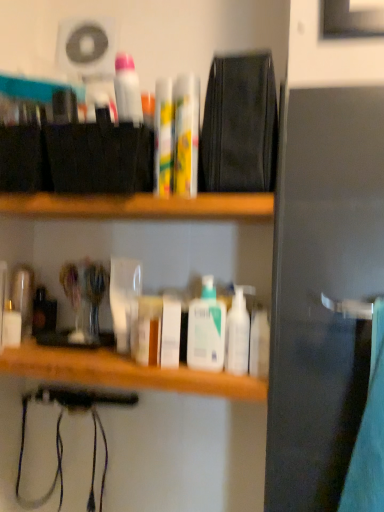
What are the coordinates of `yellow matte tube at center, the 4th toiletry positioned from the right` in the screenshot? It's located at (186, 134).

The height and width of the screenshot is (512, 384). What do you see at coordinates (147, 331) in the screenshot? I see `translucent plastic jar at center, placed as the 7th toiletry when sorted from right to left` at bounding box center [147, 331].

Locate an element on the screen. This screenshot has width=384, height=512. clear glass jar at center, positioned as the eighth toiletry in right-to-left order is located at coordinates (123, 297).

Which object is positioned more to the right, white glossy lotion at center, acting as the 8th toiletry starting from the left, or white glossy toothpaste at upper center?

From the viewer's perspective, white glossy lotion at center, acting as the 8th toiletry starting from the left, appears more on the right side.

From the image's perspective, which is above, white glossy lotion at center, the 3th toiletry positioned from the right, or white glossy toothpaste at upper center?

white glossy toothpaste at upper center appears higher in the image.

Is white glossy toothpaste at upper center a part of white glossy lotion at center, acting as the 8th toiletry starting from the left?

That's incorrect, white glossy toothpaste at upper center is not inside white glossy lotion at center, acting as the 8th toiletry starting from the left.

How different are the orientations of white glossy lotion at center, acting as the 8th toiletry starting from the left, and white glossy toothpaste at upper center in degrees?

They differ by 0.00533 degrees in their facing directions.

Is white glossy bottles at center to the left or to the right of white glossy lotion at center, the second toiletry positioned from the right, in the image?

white glossy bottles at center is to the left of white glossy lotion at center, the second toiletry positioned from the right.

Does white glossy bottles at center come behind white glossy lotion at center, the second toiletry positioned from the right?

That is False.

This screenshot has width=384, height=512. I want to click on the 7th toiletry to the right of the white glossy bottles at center, counting from the anchor's position, so click(238, 332).

From the picture: From the image's perspective, does white glossy bottles at center appear higher than white glossy lotion at center, the ninth toiletry from the left?

Incorrect, from the image's perspective, white glossy bottles at center is lower than white glossy lotion at center, the ninth toiletry from the left.

Is clear glass jar at left, which appears as the 9th toiletry when viewed from the right, bigger or smaller than white glossy lotion at center, acting as the 8th toiletry starting from the left?

clear glass jar at left, which appears as the 9th toiletry when viewed from the right, is bigger than white glossy lotion at center, acting as the 8th toiletry starting from the left.

From a real-world perspective, is clear glass jar at left, placed as the 2th toiletry when sorted from left to right, located higher than white glossy lotion at center, acting as the 8th toiletry starting from the left?

Yes.

Is clear glass jar at left, placed as the 2th toiletry when sorted from left to right, positioned in front of white glossy lotion at center, the 3th toiletry positioned from the right?

That is False.

Starting from the clear glass jar at left, placed as the 2th toiletry when sorted from left to right, which toiletry is the 5th one in front? Please provide its 2D coordinates.

[(206, 329)]

From a real-world perspective, is clear glass jar at left, placed as the 2th toiletry when sorted from left to right, positioned above or below white glossy lotion at center, which appears as the 10th toiletry when viewed from the left?

clear glass jar at left, placed as the 2th toiletry when sorted from left to right, is situated higher than white glossy lotion at center, which appears as the 10th toiletry when viewed from the left, in the real world.

Identify the location of the 7th toiletry behind the white glossy lotion at center, which appears as the 10th toiletry when viewed from the left, starting your count from the anchor. (23, 298).

Visually, is clear glass jar at left, which appears as the 9th toiletry when viewed from the right, positioned to the left or to the right of white glossy lotion at center, marked as the 1th toiletry in a right-to-left arrangement?

clear glass jar at left, which appears as the 9th toiletry when viewed from the right, is positioned on white glossy lotion at center, marked as the 1th toiletry in a right-to-left arrangement,'s left side.

From the image's perspective, is clear glass jar at left, placed as the 2th toiletry when sorted from left to right, located beneath white glossy lotion at center, which appears as the 10th toiletry when viewed from the left?

Incorrect, from the image's perspective, clear glass jar at left, placed as the 2th toiletry when sorted from left to right, is higher than white glossy lotion at center, which appears as the 10th toiletry when viewed from the left.

Is white glossy toothpaste at upper center taller than translucent plastic jar at center, placed as the 7th toiletry when sorted from right to left?

In fact, white glossy toothpaste at upper center may be shorter than translucent plastic jar at center, placed as the 7th toiletry when sorted from right to left.

Is white glossy toothpaste at upper center closer to camera compared to translucent plastic jar at center, placed as the 7th toiletry when sorted from right to left?

Yes, white glossy toothpaste at upper center is closer to the viewer.

Which is correct: white glossy toothpaste at upper center is inside translucent plastic jar at center, arranged as the fourth toiletry when viewed from the left, or outside of it?

white glossy toothpaste at upper center exists outside the volume of translucent plastic jar at center, arranged as the fourth toiletry when viewed from the left.

Is white glossy toothpaste at upper center touching translucent plastic jar at center, placed as the 7th toiletry when sorted from right to left?

white glossy toothpaste at upper center and translucent plastic jar at center, placed as the 7th toiletry when sorted from right to left, are clearly separated.

Consider the image. Could you tell me if white glossy lotion at center, acting as the fifth toiletry starting from the right, is turned towards white glossy lotion at center, the ninth toiletry from the left?

No, white glossy lotion at center, acting as the fifth toiletry starting from the right, is not facing towards white glossy lotion at center, the ninth toiletry from the left.

From their relative heights in the image, would you say white glossy lotion at center, the 6th toiletry in the left-to-right sequence, is taller or shorter than white glossy lotion at center, the ninth toiletry from the left?

white glossy lotion at center, the 6th toiletry in the left-to-right sequence, is shorter than white glossy lotion at center, the ninth toiletry from the left.

Which is in front, white glossy lotion at center, the 6th toiletry in the left-to-right sequence, or white glossy lotion at center, the ninth toiletry from the left?

white glossy lotion at center, the ninth toiletry from the left, is in front.

Considering the relative sizes of white glossy lotion at center, acting as the fifth toiletry starting from the right, and white glossy lotion at center, the ninth toiletry from the left, in the image provided, is white glossy lotion at center, acting as the fifth toiletry starting from the right, thinner than white glossy lotion at center, the ninth toiletry from the left,?

No.

Is yellow-green plastic tubes at center, the 5th toiletry positioned from the left, thinner than white glossy toothpaste at upper center?

Yes.

From the image's perspective, who appears lower, yellow-green plastic tubes at center, the 5th toiletry positioned from the left, or white glossy toothpaste at upper center?

yellow-green plastic tubes at center, the 5th toiletry positioned from the left, is shown below in the image.

Which toiletry is the 2nd one when counting from the right side of the white glossy toothpaste at upper center? Please provide its 2D coordinates.

[(163, 138)]

What's the angular difference between yellow-green plastic tubes at center, the 5th toiletry positioned from the left, and white glossy toothpaste at upper center's facing directions?

0.00107 degrees separate the facing orientations of yellow-green plastic tubes at center, the 5th toiletry positioned from the left, and white glossy toothpaste at upper center.

Find the location of a particular element. The width and height of the screenshot is (384, 512). toothpaste in front of the white glossy lotion at center, acting as the 8th toiletry starting from the left is located at coordinates (127, 90).

From the white glossy bottles at center, count 7th toiletry to the right and point to it. Please provide its 2D coordinates.

[(238, 332)]

From the image, which object appears to be nearer to yellow-green plastic tubes at center, arranged as the 6th toiletry when viewed from the right, yellow matte tube at center, placed as the seventh toiletry when sorted from left to right, or wooden shelf at center?

yellow matte tube at center, placed as the seventh toiletry when sorted from left to right.

From the image, which object appears to be nearer to wooden shelf at center, yellow-green plastic tubes at center, arranged as the 6th toiletry when viewed from the right, or translucent plastic jar at center, arranged as the fourth toiletry when viewed from the left?

yellow-green plastic tubes at center, arranged as the 6th toiletry when viewed from the right, is positioned closer to the anchor wooden shelf at center.

In the scene shown: From the image, which object appears to be farther from yellow-green plastic tubes at center, arranged as the 6th toiletry when viewed from the right, white glossy jar at lower left, the 1th toiletry when ordered from left to right, or white glossy bottles at center?

white glossy jar at lower left, the 1th toiletry when ordered from left to right, is positioned further to the anchor yellow-green plastic tubes at center, arranged as the 6th toiletry when viewed from the right.

Estimate the real-world distances between objects in this image. Which object is further from white glossy bottles at center, white glossy lotion at center, marked as the 1th toiletry in a right-to-left arrangement, or clear glass jar at left, placed as the 2th toiletry when sorted from left to right?

clear glass jar at left, placed as the 2th toiletry when sorted from left to right.

When comparing their distances from white glossy toothpaste at upper center, does yellow-green plastic tubes at center, arranged as the 6th toiletry when viewed from the right, or white glossy lotion at center, which appears as the 10th toiletry when viewed from the left, seem closer?

The object closer to white glossy toothpaste at upper center is yellow-green plastic tubes at center, arranged as the 6th toiletry when viewed from the right.

Looking at the image, which one is located further to white glossy bottles at center, clear glass jar at left, placed as the 2th toiletry when sorted from left to right, or clear glass jar at center, positioned as the eighth toiletry in right-to-left order?

clear glass jar at left, placed as the 2th toiletry when sorted from left to right, is positioned further to the anchor white glossy bottles at center.

Considering their positions, is clear glass jar at center, placed as the 3th toiletry when sorted from left to right, positioned closer to yellow-green plastic tubes at center, arranged as the 6th toiletry when viewed from the right, than translucent plastic jar at center, arranged as the fourth toiletry when viewed from the left?

Among the two, clear glass jar at center, placed as the 3th toiletry when sorted from left to right, is located nearer to yellow-green plastic tubes at center, arranged as the 6th toiletry when viewed from the right.

When comparing their distances from white glossy lotion at center, the second toiletry positioned from the right, does white glossy bottles at center or white glossy lotion at center, marked as the 1th toiletry in a right-to-left arrangement, seem further?

Based on the image, white glossy bottles at center appears to be further to white glossy lotion at center, the second toiletry positioned from the right.

Identify the location of toiletry located between clear glass jar at left, which appears as the 9th toiletry when viewed from the right, and translucent plastic jar at center, placed as the 7th toiletry when sorted from right to left, in the left-right direction. (123, 297).

The image size is (384, 512). In order to click on shelf between white glossy jar at lower left, the 1th toiletry when ordered from left to right, and white glossy lotion at center, the 6th toiletry in the left-to-right sequence in this screenshot , I will do `click(141, 206)`.

Locate an element on the screen. The width and height of the screenshot is (384, 512). shelf between yellow-green plastic tubes at center, the 5th toiletry positioned from the left, and white glossy bottles at center from top to bottom is located at coordinates (141, 206).

This screenshot has width=384, height=512. In order to click on shelf between white glossy toothpaste at upper center and white glossy bottles at center in the up-down direction in this screenshot , I will do `click(141, 206)`.